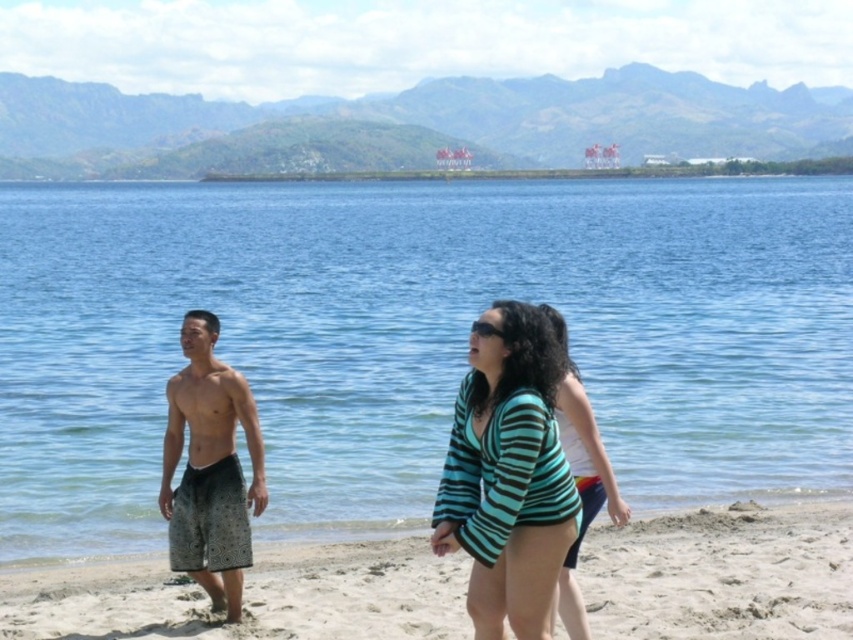
The image size is (853, 640). In order to click on blue water at center in this screenshot , I will do `click(415, 339)`.

The image size is (853, 640). Describe the element at coordinates (415, 339) in the screenshot. I see `blue water at center` at that location.

Where is `blue water at center`? The height and width of the screenshot is (640, 853). blue water at center is located at coordinates (415, 339).

Is point (379, 593) more distant than point (563, 332)?

Yes.

Who is higher up, light beige sand at lower center or teal striped swimsuit at center?

teal striped swimsuit at center is above.

You are a GUI agent. You are given a task and a screenshot of the screen. Output one action in this format:
    pyautogui.click(x=<x>, y=<y>)
    Task: Click on the light beige sand at lower center
    The image size is (853, 640).
    Given the screenshot: What is the action you would take?
    pyautogui.click(x=250, y=596)

Measure the distance from teal striped sweater at center to smooth skin torso at center.

They are 3.99 meters apart.

Is point (518, 557) positioned behind point (218, 404)?

No, it is not.

Where is `teal striped sweater at center`? Image resolution: width=853 pixels, height=640 pixels. teal striped sweater at center is located at coordinates (508, 474).